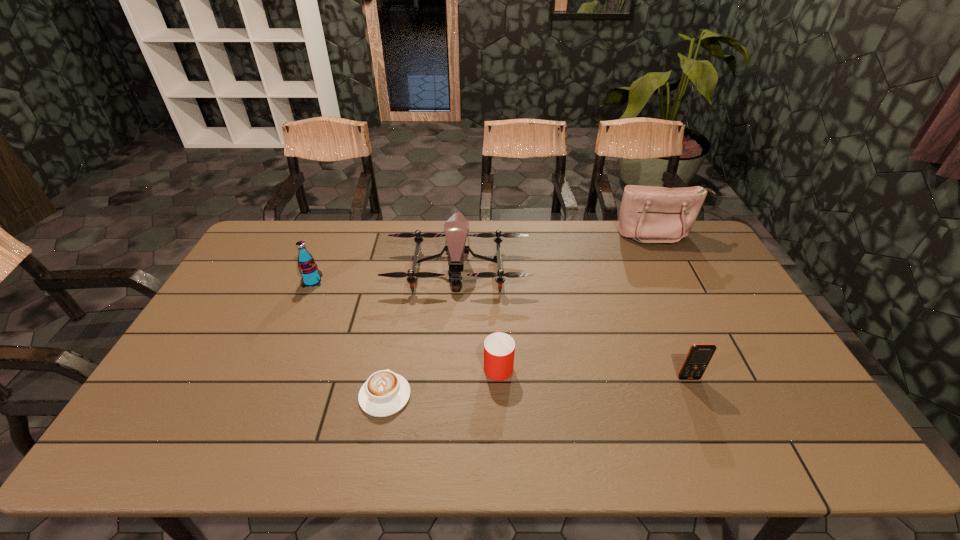
This screenshot has height=540, width=960. Find the location of `vacant space located on the side of the fifth tallest object with the handle`. vacant space located on the side of the fifth tallest object with the handle is located at coordinates [495, 280].

Identify the location of vacant space located on the side of the fifth tallest object with the handle. The width and height of the screenshot is (960, 540). (494, 259).

Locate an element on the screen. free location located on the side of the fifth tallest object with the handle is located at coordinates (494, 274).

The image size is (960, 540). In order to click on vacant space located 0.170m with the handle on the right side of the shortest object in this screenshot , I will do [x=397, y=327].

The height and width of the screenshot is (540, 960). I want to click on free point located with the handle on the right side of the shortest object, so click(x=393, y=354).

The image size is (960, 540). In order to click on free point located with the handle on the right side of the shortest object in this screenshot , I will do `click(400, 315)`.

Where is `shoulder bag present at the far edge`? The height and width of the screenshot is (540, 960). shoulder bag present at the far edge is located at coordinates coord(648,214).

Image resolution: width=960 pixels, height=540 pixels. I want to click on drone located in the far edge section of the desktop, so click(456, 228).

In order to click on object located in the right edge section of the desktop in this screenshot , I will do `click(648, 214)`.

Locate an element on the screen. This screenshot has width=960, height=540. object that is at the far right corner is located at coordinates click(x=648, y=214).